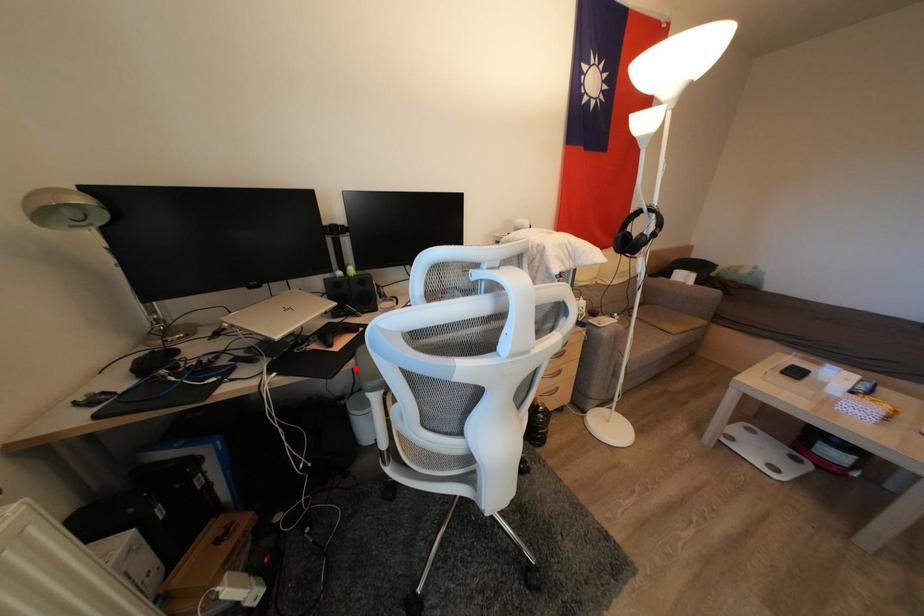
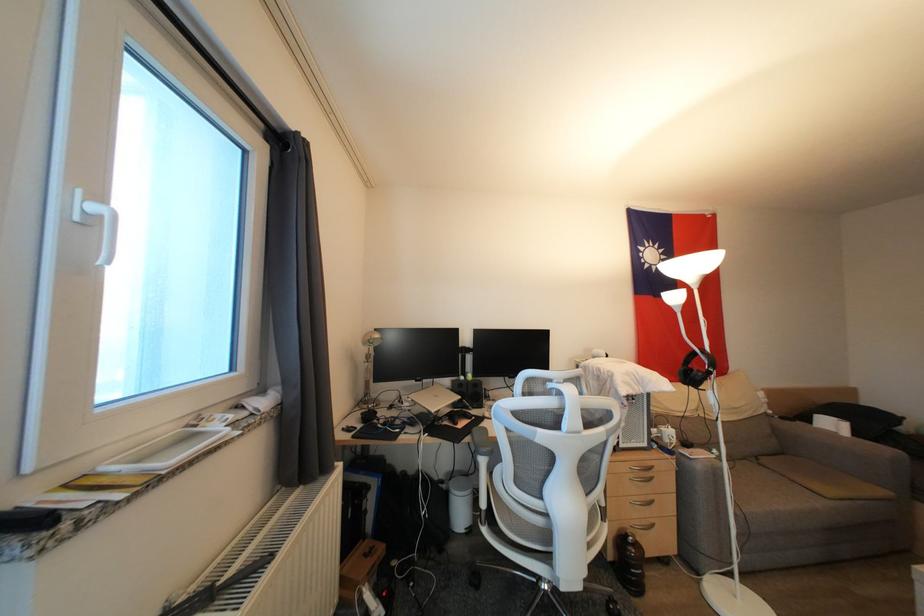
Locate, in the second image, the point that corresponds to the highlighted location in the first image.

(472, 443)